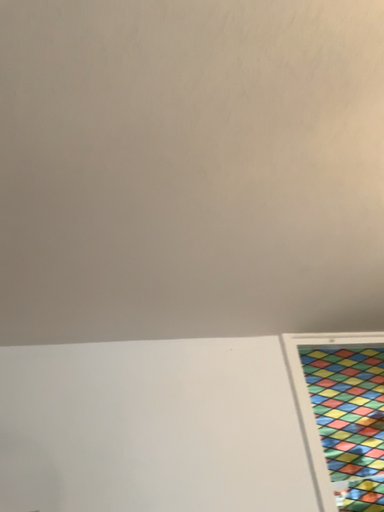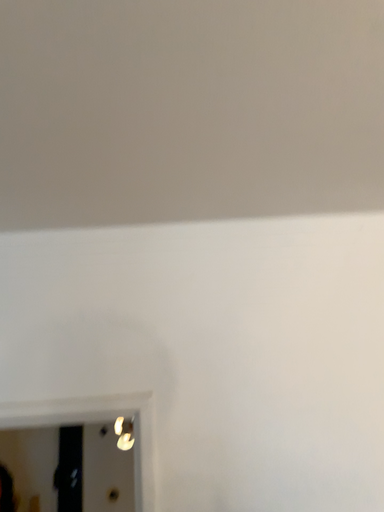
Question: Which way did the camera rotate in the video?

Choices:
 (A) rotated left
 (B) rotated right

Answer: (A)